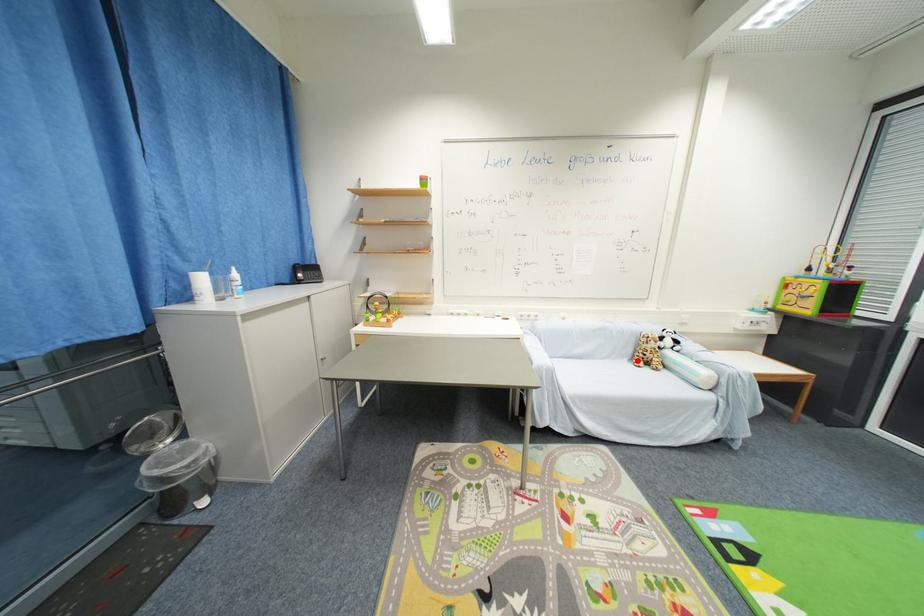
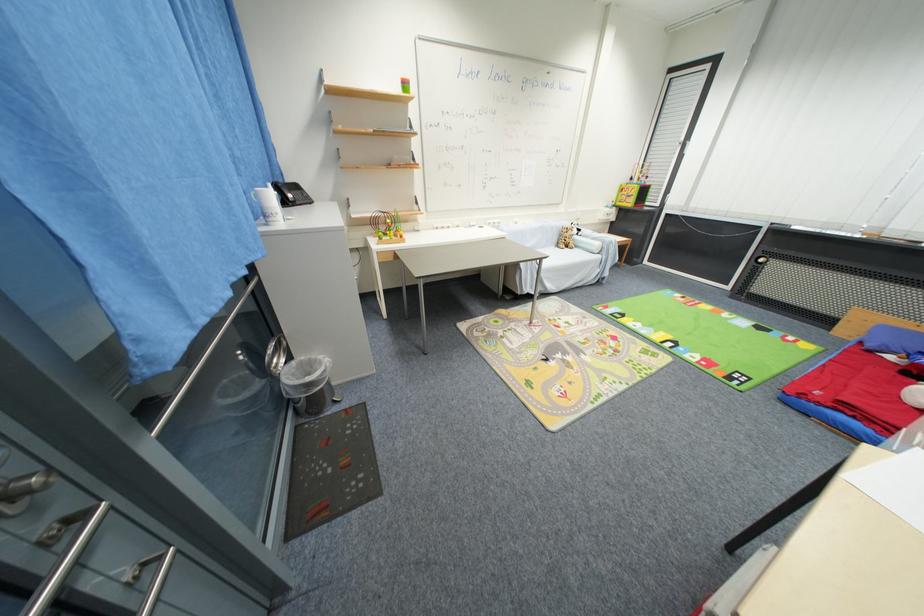
Question: I am providing you with two images of the same scene from different viewpoints. Given a red point in image1, look at the same physical point in image2. Is it:

Choices:
 (A) Closer to the viewpoint
 (B) Farther from the viewpoint

Answer: (B)